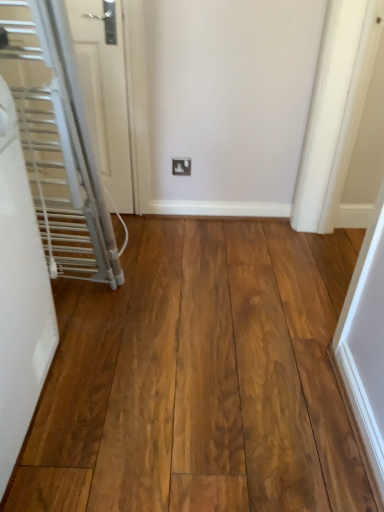
Where is `vacant space to the right of white matte radiator at left, arranged as the 2th door when viewed from the back`? vacant space to the right of white matte radiator at left, arranged as the 2th door when viewed from the back is located at coordinates (135, 401).